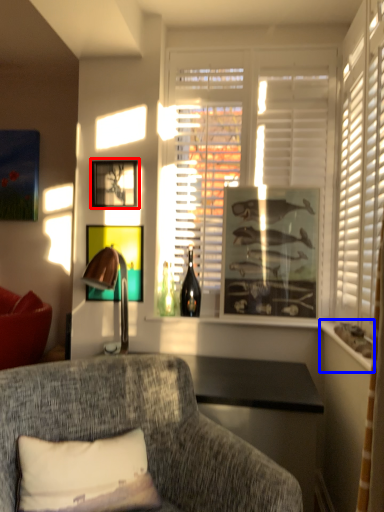
Question: Which object appears farthest to the camera in this image, picture frame (highlighted by a red box) or window sill (highlighted by a blue box)?

Choices:
 (A) picture frame
 (B) window sill

Answer: (A)